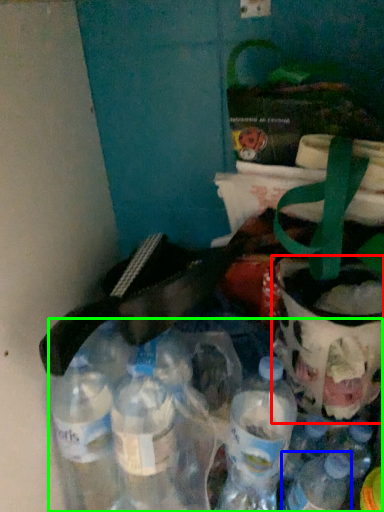
Question: Considering the real-world distances, which object is closest to glass jar (highlighted by a red box)? bottle (highlighted by a blue box) or bottle (highlighted by a green box).

Choices:
 (A) bottle
 (B) bottle

Answer: (A)